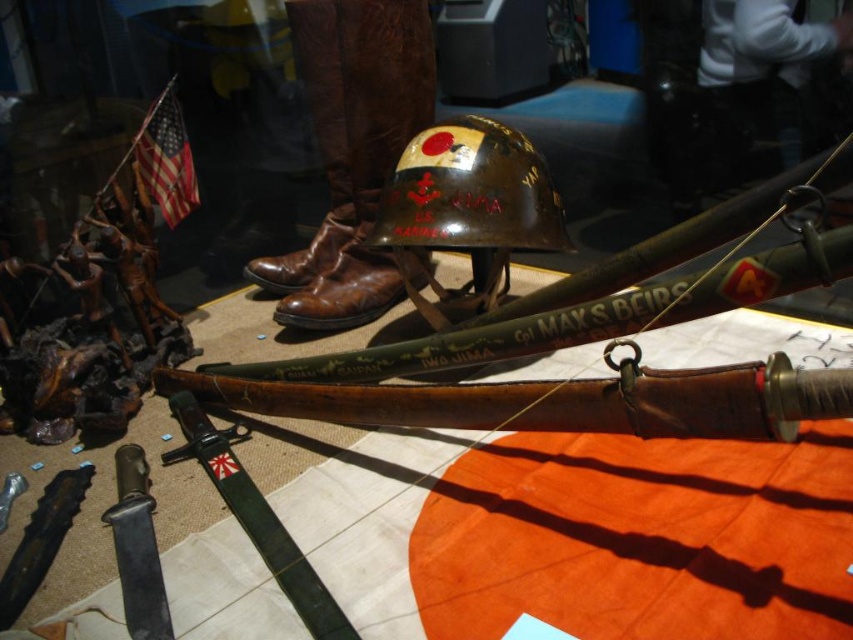
Can you confirm if shiny brown helmet at center is taller than matte black knife at lower left?

Indeed, shiny brown helmet at center has a greater height compared to matte black knife at lower left.

Which is below, shiny brown helmet at center or matte black knife at lower left?

Positioned lower is matte black knife at lower left.

Locate an element on the screen. Image resolution: width=853 pixels, height=640 pixels. shiny brown helmet at center is located at coordinates tap(467, 211).

Image resolution: width=853 pixels, height=640 pixels. In order to click on shiny brown helmet at center in this screenshot , I will do `click(467, 211)`.

Where is `shiny brown helmet at center`? Image resolution: width=853 pixels, height=640 pixels. shiny brown helmet at center is located at coordinates (467, 211).

Who is more distant from viewer, (519, 208) or (318, 627)?

The point (519, 208) is more distant.

Locate an element on the screen. The image size is (853, 640). shiny brown helmet at center is located at coordinates (467, 211).

Is brown leather boot at center positioned in front of green leather sword at center?

No, it is behind green leather sword at center.

Can you confirm if brown leather boot at center is shorter than green leather sword at center?

No, brown leather boot at center is not shorter than green leather sword at center.

Measure the distance between point [387,97] and camera.

Point [387,97] is 1.78 meters away from camera.

The height and width of the screenshot is (640, 853). Identify the location of brown leather boot at center. (352, 150).